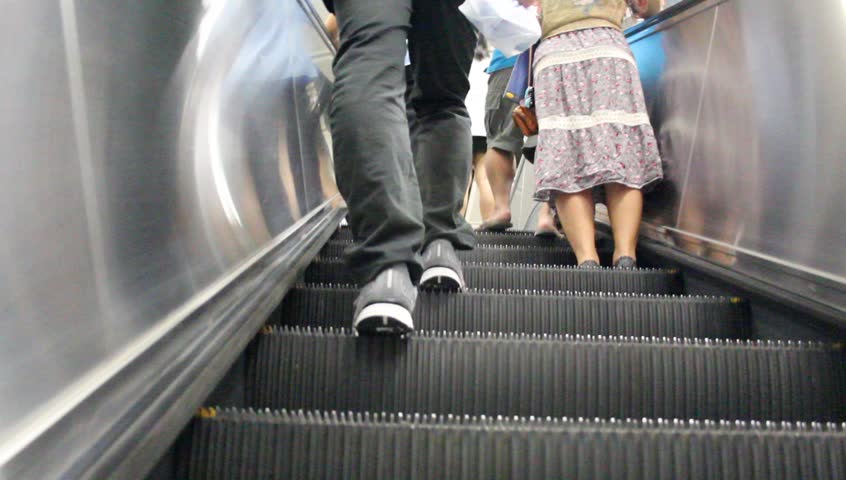
Find the location of `handrail`. handrail is located at coordinates (310, 11), (673, 12).